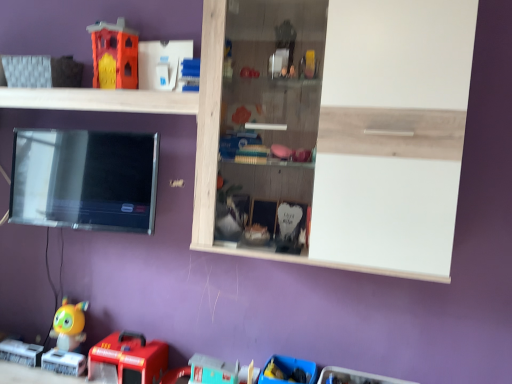
What do you see at coordinates (289, 371) in the screenshot?
I see `blue plastic toy at lower center, the fourth toy positioned from the left` at bounding box center [289, 371].

Describe the element at coordinates (101, 100) in the screenshot. I see `white wood shelf at upper center, arranged as the first shelf when viewed from the left` at that location.

At what (x,y) coordinates should I click in order to perform the action: click on white wood shelf at upper center, arranged as the first shelf when viewed from the left. Please return your answer as a coordinate pair (x, y). This screenshot has height=384, width=512. Looking at the image, I should click on (101, 100).

The width and height of the screenshot is (512, 384). What do you see at coordinates (114, 55) in the screenshot? I see `orange matte fire station at upper left, the 2th toy from the left` at bounding box center [114, 55].

The height and width of the screenshot is (384, 512). I want to click on wooden cabinet at upper center, positioned as the 2th shelf in left-to-right order, so click(368, 135).

In order to click on rubberized red fire truck at lower left, marked as the second toy in a bottom-to-top arrangement in this screenshot , I will do `click(127, 359)`.

From a real-world perspective, is white wood shelf at upper center, arranged as the first shelf when viewed from the left, located beneath rubberized red fire truck at lower left, the second toy from the right?

No, from a real-world perspective, white wood shelf at upper center, arranged as the first shelf when viewed from the left, is not below rubberized red fire truck at lower left, the second toy from the right.

Is white wood shelf at upper center, arranged as the first shelf when viewed from the left, smaller than rubberized red fire truck at lower left, which is counted as the third toy, starting from the left?

No.

Visually, is white wood shelf at upper center, arranged as the first shelf when viewed from the left, positioned to the left or to the right of rubberized red fire truck at lower left, marked as the second toy in a bottom-to-top arrangement?

white wood shelf at upper center, arranged as the first shelf when viewed from the left, is to the left of rubberized red fire truck at lower left, marked as the second toy in a bottom-to-top arrangement.

Does white wood shelf at upper center, which is the second shelf in right-to-left order, turn towards rubberized red fire truck at lower left, marked as the second toy in a bottom-to-top arrangement?

No, white wood shelf at upper center, which is the second shelf in right-to-left order, does not turn towards rubberized red fire truck at lower left, marked as the second toy in a bottom-to-top arrangement.

Is blue plastic toy at lower center, placed as the 4th toy when sorted from top to bottom, taller than white wood shelf at upper center, arranged as the first shelf when viewed from the left?

Correct, blue plastic toy at lower center, placed as the 4th toy when sorted from top to bottom, is much taller as white wood shelf at upper center, arranged as the first shelf when viewed from the left.

Considering the relative sizes of blue plastic toy at lower center, the fourth toy positioned from the left, and white wood shelf at upper center, which is the second shelf in right-to-left order, in the image provided, is blue plastic toy at lower center, the fourth toy positioned from the left, smaller than white wood shelf at upper center, which is the second shelf in right-to-left order,?

Yes, blue plastic toy at lower center, the fourth toy positioned from the left, is smaller than white wood shelf at upper center, which is the second shelf in right-to-left order.

Looking at this image, does blue plastic toy at lower center, the fourth toy positioned from the left, come in front of white wood shelf at upper center, which is the second shelf in right-to-left order?

That is True.

From a real-world perspective, which object stands above the other?

From a 3D spatial view, white wood shelf at upper center, arranged as the first shelf when viewed from the left, is above.

Locate an element on the screen. This screenshot has width=512, height=384. the 3rd toy behind when counting from the blue plastic toy at lower center, the first toy in the bottom-to-top sequence is located at coordinates (69, 325).

Measure the distance from yellow matte toy at lower left, which appears as the third toy when ordered from the bottom, to blue plastic toy at lower center, the fourth toy positioned from the left.

A distance of 38.20 inches exists between yellow matte toy at lower left, which appears as the third toy when ordered from the bottom, and blue plastic toy at lower center, the fourth toy positioned from the left.

Is yellow matte toy at lower left, the 1th toy viewed from the left, aimed at blue plastic toy at lower center, the first toy in the bottom-to-top sequence?

No, yellow matte toy at lower left, the 1th toy viewed from the left, is not facing towards blue plastic toy at lower center, the first toy in the bottom-to-top sequence.

Between point (142, 338) and point (106, 69), which one is positioned in front?

The point (106, 69) is in front.

Considering the relative sizes of rubberized red fire truck at lower left, the second toy from the right, and orange matte fire station at upper left, which is the 3th toy from right to left, in the image provided, is rubberized red fire truck at lower left, the second toy from the right, smaller than orange matte fire station at upper left, which is the 3th toy from right to left,?

Actually, rubberized red fire truck at lower left, the second toy from the right, might be larger than orange matte fire station at upper left, which is the 3th toy from right to left.

From a real-world perspective, is rubberized red fire truck at lower left, the second toy from the right, positioned above or below orange matte fire station at upper left, which appears as the first toy when viewed from the top?

rubberized red fire truck at lower left, the second toy from the right, is situated lower than orange matte fire station at upper left, which appears as the first toy when viewed from the top, in the real world.

Which object is closer to the camera, rubberized red fire truck at lower left, which is counted as the third toy, starting from the left, or orange matte fire station at upper left, the 2th toy from the left?

rubberized red fire truck at lower left, which is counted as the third toy, starting from the left, is in front.

Which object is further away from the camera, orange matte fire station at upper left, acting as the 4th toy starting from the bottom, or white wood shelf at upper center, arranged as the first shelf when viewed from the left?

orange matte fire station at upper left, acting as the 4th toy starting from the bottom.

Considering the sizes of objects orange matte fire station at upper left, which appears as the first toy when viewed from the top, and white wood shelf at upper center, arranged as the first shelf when viewed from the left, in the image provided, who is thinner, orange matte fire station at upper left, which appears as the first toy when viewed from the top, or white wood shelf at upper center, arranged as the first shelf when viewed from the left,?

orange matte fire station at upper left, which appears as the first toy when viewed from the top, is thinner.

From the image's perspective, which object appears higher, orange matte fire station at upper left, the 2th toy from the left, or white wood shelf at upper center, arranged as the first shelf when viewed from the left?

orange matte fire station at upper left, the 2th toy from the left, from the image's perspective.

Which of these two, orange matte fire station at upper left, which is the 3th toy from right to left, or white wood shelf at upper center, arranged as the first shelf when viewed from the left, stands shorter?

white wood shelf at upper center, arranged as the first shelf when viewed from the left.

From a real-world perspective, between orange matte fire station at upper left, acting as the 4th toy starting from the bottom, and blue plastic toy at lower center, the first toy in the bottom-to-top sequence, who is vertically higher?

orange matte fire station at upper left, acting as the 4th toy starting from the bottom, from a real-world perspective.

Does orange matte fire station at upper left, which is the 3th toy from right to left, come behind blue plastic toy at lower center, placed as the 4th toy when sorted from top to bottom?

Yes, it is behind blue plastic toy at lower center, placed as the 4th toy when sorted from top to bottom.

Looking at this image, does orange matte fire station at upper left, which is the 3th toy from right to left, have a lesser width compared to blue plastic toy at lower center, the fourth toy positioned from the left?

Yes, orange matte fire station at upper left, which is the 3th toy from right to left, is thinner than blue plastic toy at lower center, the fourth toy positioned from the left.

Identify the location of toy that is the 3rd object located above the blue plastic toy at lower center, the fourth toy positioned from the left (from the image's perspective). (114, 55).

The image size is (512, 384). In order to click on toy above the wooden cabinet at upper center, positioned as the 2th shelf in left-to-right order (from the image's perspective) in this screenshot , I will do `click(114, 55)`.

Would you say wooden cabinet at upper center, positioned as the 2th shelf in left-to-right order, is outside orange matte fire station at upper left, acting as the 4th toy starting from the bottom?

Indeed, wooden cabinet at upper center, positioned as the 2th shelf in left-to-right order, is completely outside orange matte fire station at upper left, acting as the 4th toy starting from the bottom.

Is wooden cabinet at upper center, positioned as the 2th shelf in left-to-right order, at the left side of orange matte fire station at upper left, the 2th toy from the left?

No.

Is wooden cabinet at upper center, positioned as the 2th shelf in left-to-right order, in front of or behind orange matte fire station at upper left, acting as the 4th toy starting from the bottom, in the image?

Visually, wooden cabinet at upper center, positioned as the 2th shelf in left-to-right order, is located in front of orange matte fire station at upper left, acting as the 4th toy starting from the bottom.

From a real-world perspective, which toy is the 3rd one underneath the white wood shelf at upper center, arranged as the first shelf when viewed from the left? Please provide its 2D coordinates.

[(127, 359)]

Image resolution: width=512 pixels, height=384 pixels. In order to click on toy in front of the white wood shelf at upper center, arranged as the first shelf when viewed from the left in this screenshot , I will do `click(289, 371)`.

Estimate the real-world distances between objects in this image. Which object is further from orange matte fire station at upper left, acting as the 4th toy starting from the bottom, wooden cabinet at upper center, positioned as the first shelf in right-to-left order, or blue plastic toy at lower center, the first toy in the bottom-to-top sequence?

blue plastic toy at lower center, the first toy in the bottom-to-top sequence.

Looking at the image, which one is located further to rubberized red fire truck at lower left, the 3th toy when ordered from top to bottom, white wood shelf at upper center, which is the second shelf in right-to-left order, or wooden cabinet at upper center, positioned as the first shelf in right-to-left order?

The object further to rubberized red fire truck at lower left, the 3th toy when ordered from top to bottom, is white wood shelf at upper center, which is the second shelf in right-to-left order.

Looking at the image, which one is located closer to yellow matte toy at lower left, the 1th toy viewed from the left, orange matte fire station at upper left, acting as the 4th toy starting from the bottom, or blue plastic toy at lower center, placed as the 4th toy when sorted from top to bottom?

The object closer to yellow matte toy at lower left, the 1th toy viewed from the left, is blue plastic toy at lower center, placed as the 4th toy when sorted from top to bottom.

When comparing their distances from blue plastic toy at lower center, which ranks as the 1th toy in right-to-left order, does white wood shelf at upper center, arranged as the first shelf when viewed from the left, or yellow matte toy at lower left, the 2th toy from the top, seem further?

Among the two, white wood shelf at upper center, arranged as the first shelf when viewed from the left, is located further to blue plastic toy at lower center, which ranks as the 1th toy in right-to-left order.

Considering their positions, is rubberized red fire truck at lower left, marked as the second toy in a bottom-to-top arrangement, positioned closer to orange matte fire station at upper left, acting as the 4th toy starting from the bottom, than yellow matte toy at lower left, the 1th toy viewed from the left?

yellow matte toy at lower left, the 1th toy viewed from the left, is closer to orange matte fire station at upper left, acting as the 4th toy starting from the bottom.

Based on their spatial positions, is wooden cabinet at upper center, positioned as the first shelf in right-to-left order, or rubberized red fire truck at lower left, the second toy from the right, further from blue plastic toy at lower center, which ranks as the 1th toy in right-to-left order?

wooden cabinet at upper center, positioned as the first shelf in right-to-left order.

When comparing their distances from orange matte fire station at upper left, the 2th toy from the left, does wooden cabinet at upper center, positioned as the first shelf in right-to-left order, or white wood shelf at upper center, arranged as the first shelf when viewed from the left, seem closer?

Based on the image, white wood shelf at upper center, arranged as the first shelf when viewed from the left, appears to be nearer to orange matte fire station at upper left, the 2th toy from the left.

Based on the photo, looking at the image, which one is located further to blue plastic toy at lower center, the fourth toy positioned from the left, yellow matte toy at lower left, the 1th toy viewed from the left, or wooden cabinet at upper center, positioned as the 2th shelf in left-to-right order?

yellow matte toy at lower left, the 1th toy viewed from the left, is further to blue plastic toy at lower center, the fourth toy positioned from the left.

The image size is (512, 384). I want to click on shelf situated between yellow matte toy at lower left, the 2th toy from the top, and wooden cabinet at upper center, positioned as the first shelf in right-to-left order, from left to right, so click(x=101, y=100).

At what (x,y) coordinates should I click in order to perform the action: click on toy between orange matte fire station at upper left, which appears as the first toy when viewed from the top, and rubberized red fire truck at lower left, the 3th toy when ordered from top to bottom, from top to bottom. Please return your answer as a coordinate pair (x, y). The width and height of the screenshot is (512, 384). Looking at the image, I should click on (69, 325).

Where is `toy between white wood shelf at upper center, which is the second shelf in right-to-left order, and rubberized red fire truck at lower left, the 3th toy when ordered from top to bottom, vertically`? The height and width of the screenshot is (384, 512). toy between white wood shelf at upper center, which is the second shelf in right-to-left order, and rubberized red fire truck at lower left, the 3th toy when ordered from top to bottom, vertically is located at coordinates (69, 325).

The width and height of the screenshot is (512, 384). Identify the location of shelf that lies between white wood shelf at upper center, arranged as the first shelf when viewed from the left, and rubberized red fire truck at lower left, which is counted as the third toy, starting from the left, from top to bottom. (368, 135).